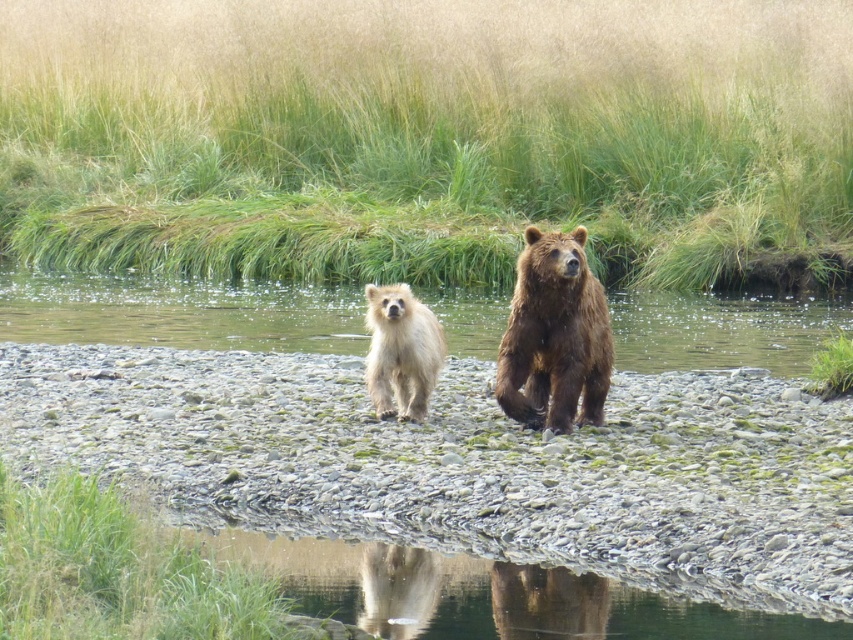
Is brown fur river at center below fuzzy fur bear at center?

No.

Who is more distant from viewer, (x=659, y=310) or (x=395, y=308)?

The point (x=659, y=310) is more distant.

Between point (13, 339) and point (386, 326), which one is positioned behind?

Positioned behind is point (13, 339).

The height and width of the screenshot is (640, 853). Find the location of `brown fur river at center`. brown fur river at center is located at coordinates (178, 310).

Does green mossy rocks at center appear over fuzzy fur bear at center?

No, green mossy rocks at center is not above fuzzy fur bear at center.

Is green mossy rocks at center to the right of fuzzy fur bear at center from the viewer's perspective?

In fact, green mossy rocks at center is to the left of fuzzy fur bear at center.

Image resolution: width=853 pixels, height=640 pixels. I want to click on green mossy rocks at center, so [x=466, y=464].

Locate an element on the screen. The image size is (853, 640). green mossy rocks at center is located at coordinates (466, 464).

This screenshot has height=640, width=853. Find the location of `green mossy rocks at center`. green mossy rocks at center is located at coordinates (466, 464).

Does green mossy rocks at center appear under brown fur river at center?

Indeed, green mossy rocks at center is positioned under brown fur river at center.

Describe the element at coordinates (466, 464) in the screenshot. I see `green mossy rocks at center` at that location.

Where is `green mossy rocks at center`? The image size is (853, 640). green mossy rocks at center is located at coordinates (466, 464).